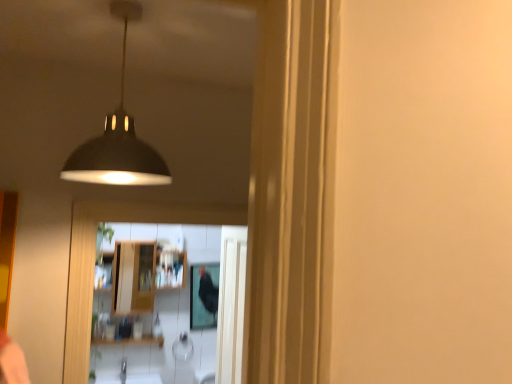
Question: Based on their sizes in the image, would you say matte black lampshade at upper center is bigger or smaller than black glossy mirror at center?

Choices:
 (A) big
 (B) small

Answer: (A)

Question: From a real-world perspective, is matte black lampshade at upper center positioned above or below black glossy mirror at center?

Choices:
 (A) below
 (B) above

Answer: (B)

Question: From the image's perspective, relative to black glossy mirror at center, is matte black lampshade at upper center above or below?

Choices:
 (A) below
 (B) above

Answer: (B)

Question: Would you say black glossy mirror at center is to the left or to the right of matte black lampshade at upper center in the picture?

Choices:
 (A) right
 (B) left

Answer: (A)

Question: In terms of height, does black glossy mirror at center look taller or shorter compared to matte black lampshade at upper center?

Choices:
 (A) tall
 (B) short

Answer: (A)

Question: From the image's perspective, is black glossy mirror at center positioned above or below matte black lampshade at upper center?

Choices:
 (A) above
 (B) below

Answer: (B)

Question: In terms of width, does black glossy mirror at center look wider or thinner when compared to matte black lampshade at upper center?

Choices:
 (A) thin
 (B) wide

Answer: (A)